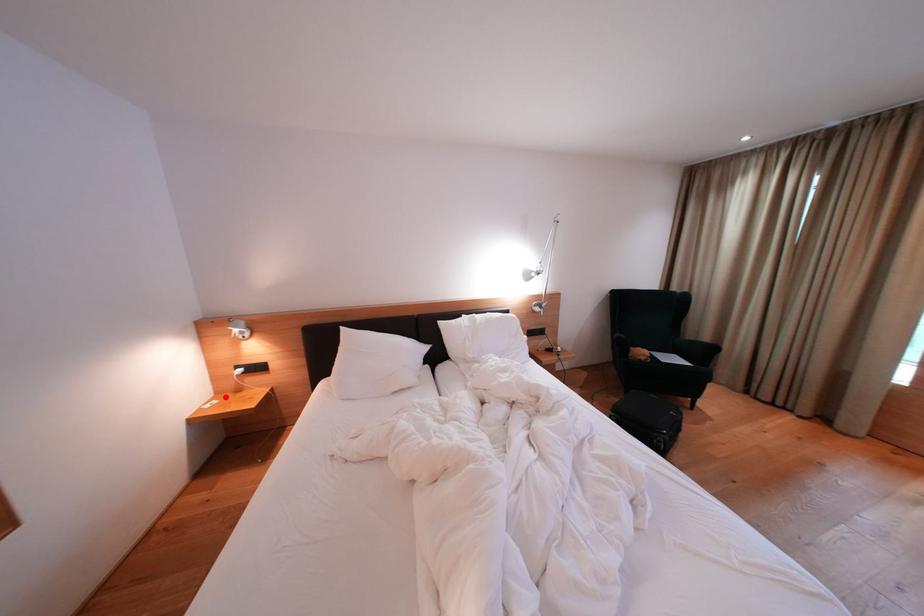
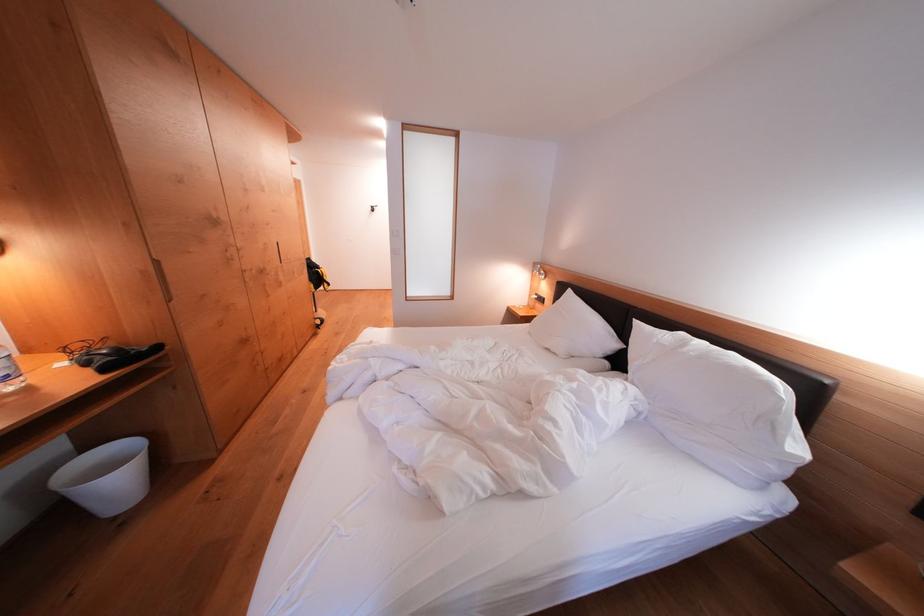
In the second image, find the point that corresponds to the highlighted location in the first image.

(536, 310)